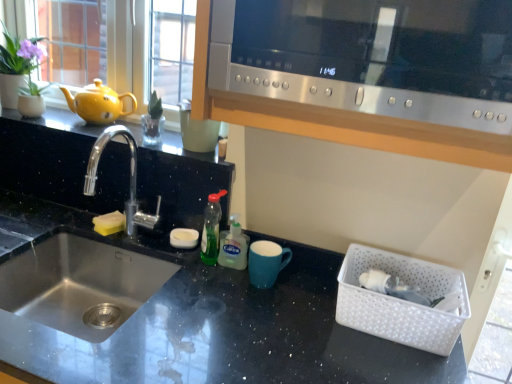
Question: Is green translucent bottle at center, the 1th bottle from the left, thinner than silver metallic faucet at left?

Choices:
 (A) no
 (B) yes

Answer: (B)

Question: Would you say green translucent bottle at center, which is counted as the 2th bottle, starting from the right, contains silver metallic faucet at left?

Choices:
 (A) no
 (B) yes

Answer: (A)

Question: Are green translucent bottle at center, which is counted as the 2th bottle, starting from the right, and silver metallic faucet at left beside each other?

Choices:
 (A) no
 (B) yes

Answer: (A)

Question: Is green translucent bottle at center, the 1th bottle from the left, wider than silver metallic faucet at left?

Choices:
 (A) no
 (B) yes

Answer: (A)

Question: From the image's perspective, is green translucent bottle at center, the 1th bottle from the left, located above silver metallic faucet at left?

Choices:
 (A) yes
 (B) no

Answer: (B)

Question: From a real-world perspective, is yellow sponge at sink positioned above or below green translucent soap dispenser at center, which appears as the 2th bottle when viewed from the left?

Choices:
 (A) above
 (B) below

Answer: (B)

Question: Based on their sizes in the image, would you say yellow sponge at sink is bigger or smaller than green translucent soap dispenser at center, which appears as the 2th bottle when viewed from the left?

Choices:
 (A) small
 (B) big

Answer: (A)

Question: Based on their positions, is yellow sponge at sink located to the left or right of green translucent soap dispenser at center, which is the first bottle from right to left?

Choices:
 (A) left
 (B) right

Answer: (A)

Question: Is point (96, 215) closer or farther from the camera than point (223, 256)?

Choices:
 (A) farther
 (B) closer

Answer: (A)

Question: Is green matte plant at upper left taller or shorter than white plastic basket at lower right?

Choices:
 (A) short
 (B) tall

Answer: (B)

Question: From a real-world perspective, is green matte plant at upper left physically located above or below white plastic basket at lower right?

Choices:
 (A) below
 (B) above

Answer: (B)

Question: Considering the positions of point (16, 72) and point (370, 324), is point (16, 72) closer or farther from the camera than point (370, 324)?

Choices:
 (A) closer
 (B) farther

Answer: (B)

Question: In the image, is green matte plant at upper left positioned in front of or behind white plastic basket at lower right?

Choices:
 (A) behind
 (B) front

Answer: (A)

Question: Does point (2, 66) appear closer or farther from the camera than point (238, 226)?

Choices:
 (A) farther
 (B) closer

Answer: (A)

Question: Looking at their shapes, would you say green matte plant at upper left is wider or thinner than green translucent soap dispenser at center, which appears as the 2th bottle when viewed from the left?

Choices:
 (A) thin
 (B) wide

Answer: (B)